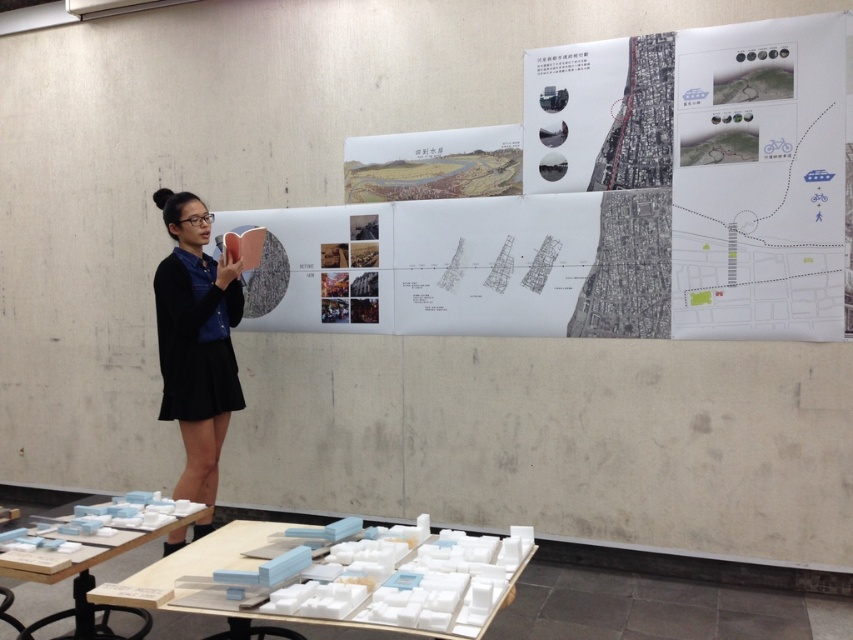
Question: Does white paper map at center have a larger size compared to white foam blocks at lower center?

Choices:
 (A) no
 (B) yes

Answer: (B)

Question: Does white foam blocks at lower center appear over black matte dress at center?

Choices:
 (A) yes
 (B) no

Answer: (B)

Question: Which object is the farthest from the black matte dress at center?

Choices:
 (A) white plastic table at lower left
 (B) white paper map at center
 (C) white foam blocks at lower center

Answer: (C)

Question: Among these points, which one is nearest to the camera?

Choices:
 (A) (137, 616)
 (B) (171, 216)

Answer: (A)

Question: Which point is closer to the camera?

Choices:
 (A) white paper map at center
 (B) white plastic table at lower left
 (C) black matte dress at center
 (D) white foam blocks at lower center

Answer: (D)

Question: Can you confirm if white foam blocks at lower center is wider than black matte dress at center?

Choices:
 (A) no
 (B) yes

Answer: (B)